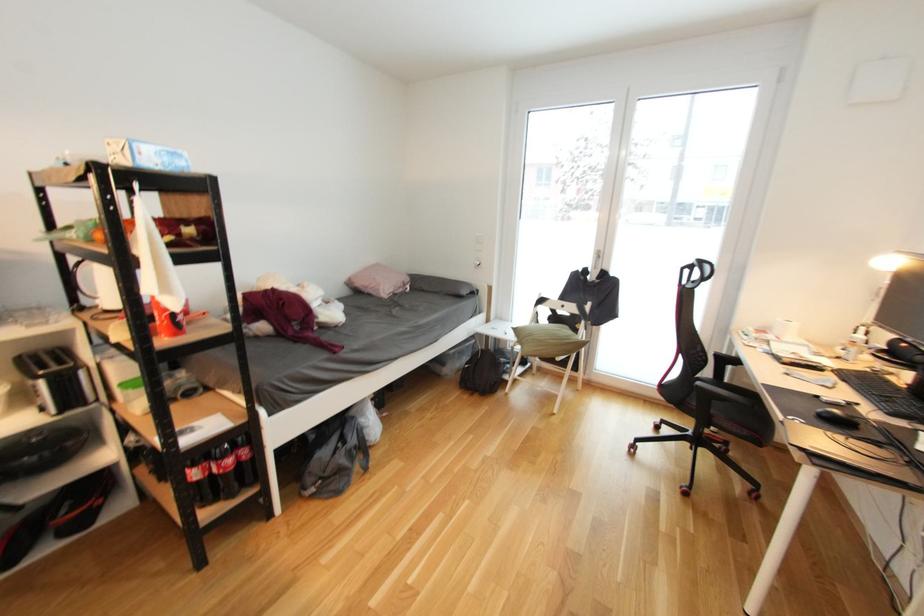
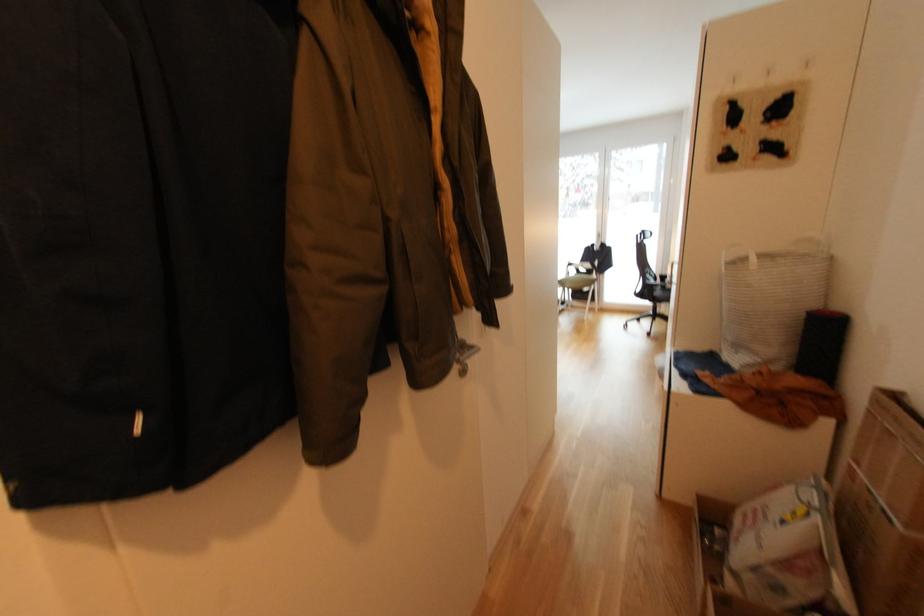
What movement of the cameraman would produce the second image?

The movement direction of the cameraman is left, backward.